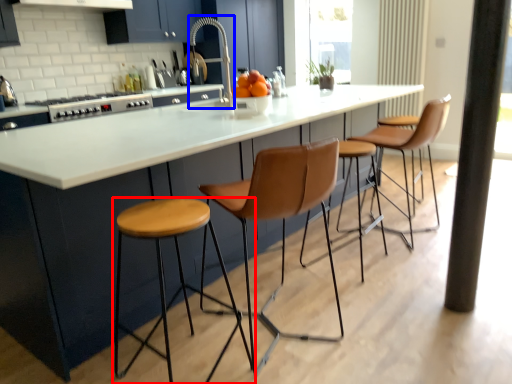
Question: Which object appears closest to the camera in this image, stool (highlighted by a red box) or faucet (highlighted by a blue box)?

Choices:
 (A) stool
 (B) faucet

Answer: (A)